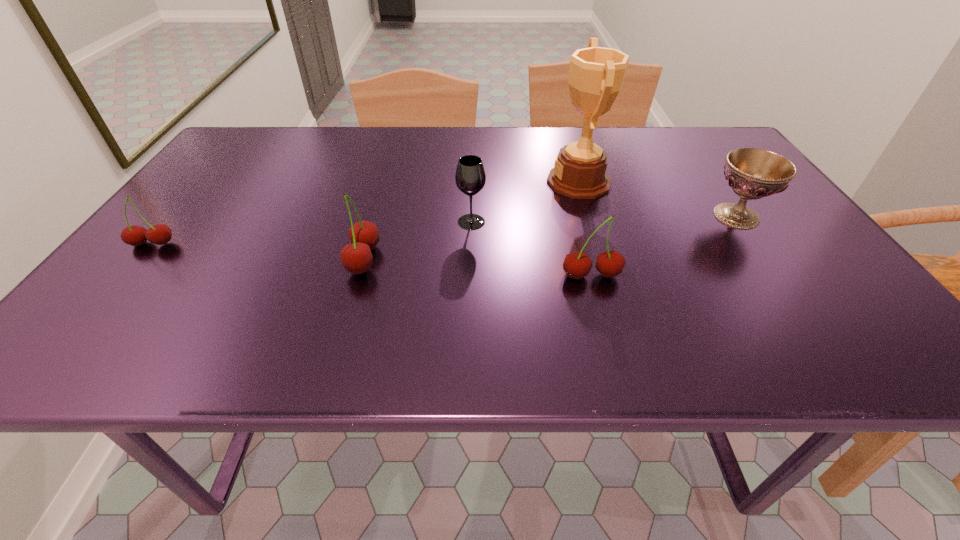
Identify the location of free space between the second shortest cherry and the chalice. (663, 246).

This screenshot has height=540, width=960. Identify the location of empty space between the wineglass and the award. (525, 201).

What are the coordinates of `the fourth closest object to the fifth object from right to left` in the screenshot? It's located at (596, 74).

I want to click on the third closest object relative to the fourth object from right to left, so click(x=577, y=265).

Where is `cherry object that ranks as the closest to the shortest cherry`? The image size is (960, 540). cherry object that ranks as the closest to the shortest cherry is located at coordinates (356, 257).

Identify which cherry is the third closest to the wineglass. Please provide its 2D coordinates. Your answer should be formatted as a tuple, i.e. [(x, y)], where the tuple contains the x and y coordinates of a point satisfying the conditions above.

[(159, 234)]

This screenshot has height=540, width=960. I want to click on vacant space that satisfies the following two spatial constraints: 1. on the front-facing side of the chalice; 2. on the left side of the tallest object, so click(x=589, y=216).

In order to click on free space that satisfies the following two spatial constraints: 1. on the front-facing side of the tallest object; 2. on the surface of the shortest cherry in this screenshot , I will do `click(597, 244)`.

The image size is (960, 540). I want to click on vacant space that satisfies the following two spatial constraints: 1. on the front-facing side of the tallest object; 2. on the surface of the leftmost cherry, so click(597, 244).

Where is `free region that satisfies the following two spatial constraints: 1. on the front-facing side of the tallest object; 2. on the surface of the leftmost object`? free region that satisfies the following two spatial constraints: 1. on the front-facing side of the tallest object; 2. on the surface of the leftmost object is located at coordinates (597, 244).